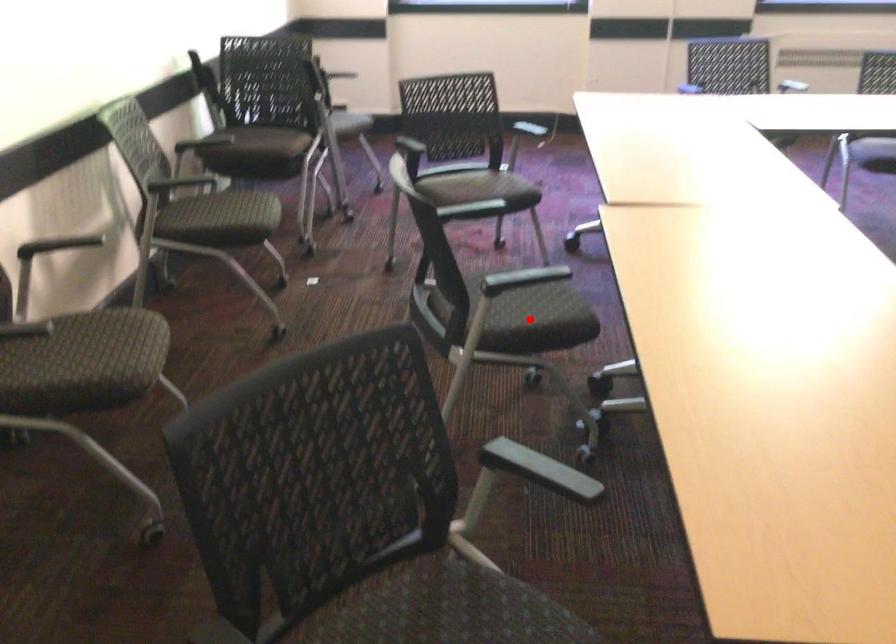
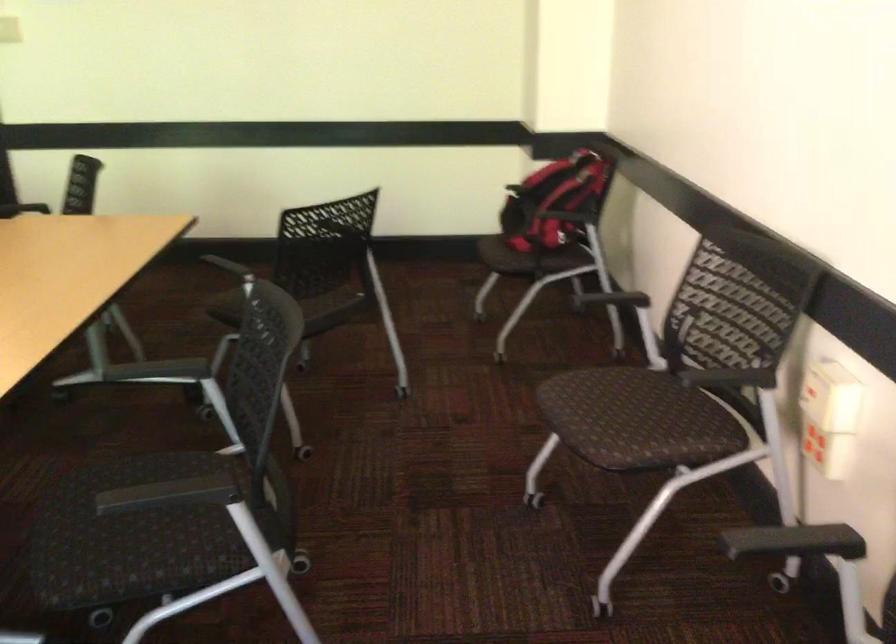
Question: I am providing you with two images of the same scene from different viewpoints. A red point is marked on the first image. Can you still see the location of the red point in image 2?

Choices:
 (A) Yes
 (B) No

Answer: (B)